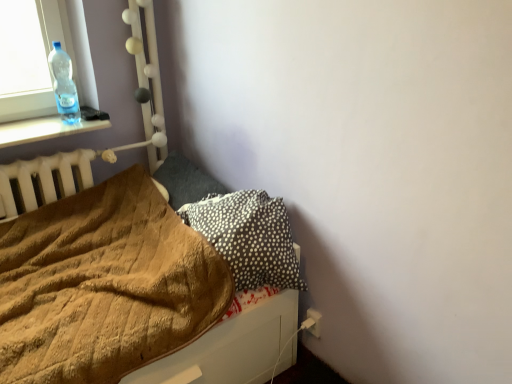
Locate an element on the screen. This screenshot has height=384, width=512. brown fuzzy blanket at lower left is located at coordinates (104, 285).

What is the approximate height of black dotted pillow at lower right, marked as the 1th pillow in a front-to-back arrangement?

The height of black dotted pillow at lower right, marked as the 1th pillow in a front-to-back arrangement, is 10.15 inches.

Image resolution: width=512 pixels, height=384 pixels. What do you see at coordinates (248, 237) in the screenshot? I see `black dotted pillow at lower right, marked as the 1th pillow in a front-to-back arrangement` at bounding box center [248, 237].

Identify the location of transparent plastic bottle at upper left. The image size is (512, 384). (64, 85).

How far apart are transparent plastic bottle at upper left and black dotted pillow at lower right, acting as the 2th pillow starting from the back?

transparent plastic bottle at upper left and black dotted pillow at lower right, acting as the 2th pillow starting from the back, are 37.10 inches apart.

Based on the photo, which object is wider, transparent plastic bottle at upper left or black dotted pillow at lower right, marked as the 1th pillow in a front-to-back arrangement?

Wider between the two is black dotted pillow at lower right, marked as the 1th pillow in a front-to-back arrangement.

Between transparent plastic bottle at upper left and black dotted pillow at lower right, marked as the 1th pillow in a front-to-back arrangement, which one has less height?

black dotted pillow at lower right, marked as the 1th pillow in a front-to-back arrangement, is shorter.

Does transparent plastic bottle at upper left come in front of black dotted pillow at lower right, marked as the 1th pillow in a front-to-back arrangement?

No, it is not.

Considering the sizes of objects transparent plastic bottle at upper left and brown fuzzy blanket at lower left in the image provided, who is shorter, transparent plastic bottle at upper left or brown fuzzy blanket at lower left?

With less height is brown fuzzy blanket at lower left.

How different are the orientations of transparent plastic bottle at upper left and brown fuzzy blanket at lower left in degrees?

There is a 4.05-degree angle between the facing directions of transparent plastic bottle at upper left and brown fuzzy blanket at lower left.

How far apart are transparent plastic bottle at upper left and brown fuzzy blanket at lower left?

A distance of 27.67 inches exists between transparent plastic bottle at upper left and brown fuzzy blanket at lower left.

Consider the image. Is transparent plastic bottle at upper left wider or thinner than brown fuzzy blanket at lower left?

In the image, transparent plastic bottle at upper left appears to be more narrow than brown fuzzy blanket at lower left.

Looking at this image, which object is thinner, brown fuzzy blanket at lower left or dark gray fabric pillow at center-left, placed as the 2th pillow when sorted from front to back?

dark gray fabric pillow at center-left, placed as the 2th pillow when sorted from front to back.

Is brown fuzzy blanket at lower left to the left or to the right of dark gray fabric pillow at center-left, placed as the 2th pillow when sorted from front to back, in the image?

Clearly, brown fuzzy blanket at lower left is on the left of dark gray fabric pillow at center-left, placed as the 2th pillow when sorted from front to back, in the image.

Is brown fuzzy blanket at lower left positioned with its back to dark gray fabric pillow at center-left, which appears as the 1th pillow when viewed from the back?

No, brown fuzzy blanket at lower left's orientation is not away from dark gray fabric pillow at center-left, which appears as the 1th pillow when viewed from the back.

From the picture: Is black dotted pillow at lower right, acting as the 2th pillow starting from the back, further to the viewer compared to transparent plastic bottle at upper left?

No, it is in front of transparent plastic bottle at upper left.

How far apart are black dotted pillow at lower right, acting as the 2th pillow starting from the back, and transparent plastic bottle at upper left?

black dotted pillow at lower right, acting as the 2th pillow starting from the back, and transparent plastic bottle at upper left are 94.22 centimeters apart from each other.

From the image's perspective, is black dotted pillow at lower right, marked as the 1th pillow in a front-to-back arrangement, above or below transparent plastic bottle at upper left?

Based on their image positions, black dotted pillow at lower right, marked as the 1th pillow in a front-to-back arrangement, is located beneath transparent plastic bottle at upper left.

Considering the sizes of objects black dotted pillow at lower right, marked as the 1th pillow in a front-to-back arrangement, and transparent plastic bottle at upper left in the image provided, who is wider, black dotted pillow at lower right, marked as the 1th pillow in a front-to-back arrangement, or transparent plastic bottle at upper left?

black dotted pillow at lower right, marked as the 1th pillow in a front-to-back arrangement, is wider.

Is black dotted pillow at lower right, marked as the 1th pillow in a front-to-back arrangement, turned away from brown fuzzy blanket at lower left?

No, black dotted pillow at lower right, marked as the 1th pillow in a front-to-back arrangement, is not facing away from brown fuzzy blanket at lower left.

The height and width of the screenshot is (384, 512). I want to click on blanket directly beneath the black dotted pillow at lower right, acting as the 2th pillow starting from the back (from a real-world perspective), so click(104, 285).

Considering the sizes of black dotted pillow at lower right, marked as the 1th pillow in a front-to-back arrangement, and brown fuzzy blanket at lower left in the image, is black dotted pillow at lower right, marked as the 1th pillow in a front-to-back arrangement, taller or shorter than brown fuzzy blanket at lower left?

In the image, black dotted pillow at lower right, marked as the 1th pillow in a front-to-back arrangement, appears to be shorter than brown fuzzy blanket at lower left.

How many degrees apart are the facing directions of black dotted pillow at lower right, acting as the 2th pillow starting from the back, and brown fuzzy blanket at lower left?

The facing directions of black dotted pillow at lower right, acting as the 2th pillow starting from the back, and brown fuzzy blanket at lower left are 90 degrees apart.

Which is more to the left, black dotted pillow at lower right, acting as the 2th pillow starting from the back, or dark gray fabric pillow at center-left, which appears as the 1th pillow when viewed from the back?

Positioned to the left is dark gray fabric pillow at center-left, which appears as the 1th pillow when viewed from the back.

Is black dotted pillow at lower right, acting as the 2th pillow starting from the back, surrounding dark gray fabric pillow at center-left, placed as the 2th pillow when sorted from front to back?

No, dark gray fabric pillow at center-left, placed as the 2th pillow when sorted from front to back, is not inside black dotted pillow at lower right, acting as the 2th pillow starting from the back.

From the image's perspective, is black dotted pillow at lower right, acting as the 2th pillow starting from the back, located above or below dark gray fabric pillow at center-left, which appears as the 1th pillow when viewed from the back?

black dotted pillow at lower right, acting as the 2th pillow starting from the back, is situated lower than dark gray fabric pillow at center-left, which appears as the 1th pillow when viewed from the back, in the image.

You are a GUI agent. You are given a task and a screenshot of the screen. Output one action in this format:
    pyautogui.click(x=<x>, y=<y>)
    Task: Click on the pillow in front of the dark gray fabric pillow at center-left, which appears as the 1th pillow when viewed from the back
    Image resolution: width=512 pixels, height=384 pixels.
    Given the screenshot: What is the action you would take?
    (x=248, y=237)

Looking at this image, is transparent plastic bottle at upper left to the left or to the right of dark gray fabric pillow at center-left, which appears as the 1th pillow when viewed from the back, in the image?

transparent plastic bottle at upper left is to the left of dark gray fabric pillow at center-left, which appears as the 1th pillow when viewed from the back.

From the picture: Can you confirm if transparent plastic bottle at upper left is shorter than dark gray fabric pillow at center-left, which appears as the 1th pillow when viewed from the back?

In fact, transparent plastic bottle at upper left may be taller than dark gray fabric pillow at center-left, which appears as the 1th pillow when viewed from the back.

From the image's perspective, is transparent plastic bottle at upper left over dark gray fabric pillow at center-left, placed as the 2th pillow when sorted from front to back?

Correct, transparent plastic bottle at upper left appears higher than dark gray fabric pillow at center-left, placed as the 2th pillow when sorted from front to back, in the image.

Is transparent plastic bottle at upper left facing away from dark gray fabric pillow at center-left, which appears as the 1th pillow when viewed from the back?

transparent plastic bottle at upper left is not turned away from dark gray fabric pillow at center-left, which appears as the 1th pillow when viewed from the back.

Locate an element on the screen. pillow in front of the transparent plastic bottle at upper left is located at coordinates (248, 237).

I want to click on bottle above the brown fuzzy blanket at lower left (from the image's perspective), so click(64, 85).

When comparing their distances from dark gray fabric pillow at center-left, which appears as the 1th pillow when viewed from the back, does transparent plastic bottle at upper left or black dotted pillow at lower right, acting as the 2th pillow starting from the back, seem further?

transparent plastic bottle at upper left.

Estimate the real-world distances between objects in this image. Which object is further from dark gray fabric pillow at center-left, placed as the 2th pillow when sorted from front to back, brown fuzzy blanket at lower left or transparent plastic bottle at upper left?

Among the two, transparent plastic bottle at upper left is located further to dark gray fabric pillow at center-left, placed as the 2th pillow when sorted from front to back.

When comparing their distances from dark gray fabric pillow at center-left, placed as the 2th pillow when sorted from front to back, does black dotted pillow at lower right, acting as the 2th pillow starting from the back, or brown fuzzy blanket at lower left seem closer?

black dotted pillow at lower right, acting as the 2th pillow starting from the back, is closer to dark gray fabric pillow at center-left, placed as the 2th pillow when sorted from front to back.

Based on their spatial positions, is transparent plastic bottle at upper left or brown fuzzy blanket at lower left further from black dotted pillow at lower right, marked as the 1th pillow in a front-to-back arrangement?

transparent plastic bottle at upper left.

Based on their spatial positions, is dark gray fabric pillow at center-left, placed as the 2th pillow when sorted from front to back, or brown fuzzy blanket at lower left closer to transparent plastic bottle at upper left?

dark gray fabric pillow at center-left, placed as the 2th pillow when sorted from front to back, is closer to transparent plastic bottle at upper left.

From the image, which object appears to be farther from transparent plastic bottle at upper left, black dotted pillow at lower right, acting as the 2th pillow starting from the back, or dark gray fabric pillow at center-left, placed as the 2th pillow when sorted from front to back?

black dotted pillow at lower right, acting as the 2th pillow starting from the back, lies further to transparent plastic bottle at upper left than the other object.

From the image, which object appears to be nearer to transparent plastic bottle at upper left, brown fuzzy blanket at lower left or dark gray fabric pillow at center-left, which appears as the 1th pillow when viewed from the back?

Among the two, dark gray fabric pillow at center-left, which appears as the 1th pillow when viewed from the back, is located nearer to transparent plastic bottle at upper left.

Which object lies nearer to the anchor point brown fuzzy blanket at lower left, transparent plastic bottle at upper left or dark gray fabric pillow at center-left, which appears as the 1th pillow when viewed from the back?

The object closer to brown fuzzy blanket at lower left is dark gray fabric pillow at center-left, which appears as the 1th pillow when viewed from the back.

Identify the location of bottle between brown fuzzy blanket at lower left and dark gray fabric pillow at center-left, placed as the 2th pillow when sorted from front to back, along the z-axis. The image size is (512, 384). (64, 85).

Identify the location of pillow between transparent plastic bottle at upper left and black dotted pillow at lower right, acting as the 2th pillow starting from the back, from left to right. The width and height of the screenshot is (512, 384). (186, 181).

Where is `blanket located between transparent plastic bottle at upper left and black dotted pillow at lower right, acting as the 2th pillow starting from the back, in the left-right direction`? Image resolution: width=512 pixels, height=384 pixels. blanket located between transparent plastic bottle at upper left and black dotted pillow at lower right, acting as the 2th pillow starting from the back, in the left-right direction is located at coordinates (104, 285).

The height and width of the screenshot is (384, 512). What are the coordinates of `pillow located between brown fuzzy blanket at lower left and dark gray fabric pillow at center-left, placed as the 2th pillow when sorted from front to back, in the depth direction` in the screenshot? It's located at (248, 237).